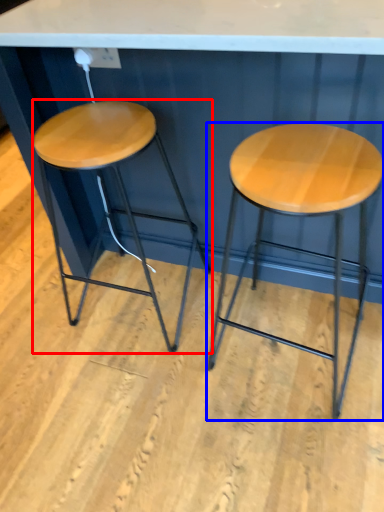
Question: Which point is closer to the camera, stool (highlighted by a red box) or stool (highlighted by a blue box)?

Choices:
 (A) stool
 (B) stool

Answer: (B)